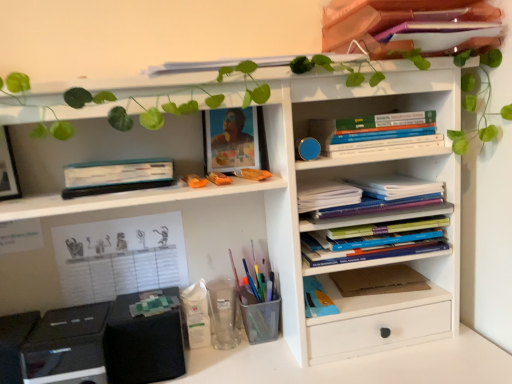
Where is `metal mesh pen holder at lower center, the first stationery from the right`? The width and height of the screenshot is (512, 384). metal mesh pen holder at lower center, the first stationery from the right is located at coordinates click(x=258, y=305).

The height and width of the screenshot is (384, 512). I want to click on transparent plastic cup at lower center, which is the 2th stationery in left-to-right order, so click(223, 313).

Identify the location of hardcover books at center right, the third book in the bottom-to-top sequence. The image size is (512, 384). (380, 133).

Measure the distance between point (381, 56) and camera.

The distance of point (381, 56) from camera is 33.62 inches.

What do you see at coordinates (392, 20) in the screenshot? This screenshot has height=384, width=512. I see `matte pink book at upper right, marked as the 4th book in a bottom-to-top arrangement` at bounding box center [392, 20].

This screenshot has height=384, width=512. Find the location of `matte plastic picture frame at upper center`. matte plastic picture frame at upper center is located at coordinates (230, 139).

Considering the relative sizes of brown cardboard at center-right, the 1th paperback book from the bottom, and hardcover books at center right, the third book in the bottom-to-top sequence, in the image provided, is brown cardboard at center-right, the 1th paperback book from the bottom, smaller than hardcover books at center right, the third book in the bottom-to-top sequence,?

Correct, brown cardboard at center-right, the 1th paperback book from the bottom, occupies less space than hardcover books at center right, the third book in the bottom-to-top sequence.

Considering the positions of point (365, 288) and point (436, 145), is point (365, 288) closer or farther from the camera than point (436, 145)?

Clearly, point (365, 288) is more distant from the camera than point (436, 145).

Does brown cardboard at center-right, the 1th paperback book from the bottom, appear on the left side of hardcover books at center right, the third book in the bottom-to-top sequence?

In fact, brown cardboard at center-right, the 1th paperback book from the bottom, is to the right of hardcover books at center right, the third book in the bottom-to-top sequence.

Is hardcover books at center right, the second book when ordered from top to bottom, completely or partially inside brown cardboard at center-right, which is the 3th paperback book in top-to-bottom order?

No, hardcover books at center right, the second book when ordered from top to bottom, is not a part of brown cardboard at center-right, which is the 3th paperback book in top-to-bottom order.

Is transparent plastic cup at lower center, which is the 2th stationery in left-to-right order, further to the viewer compared to white matte plastic container at lower center, arranged as the first stationery when viewed from the left?

Yes, it is.

From the image's perspective, is transparent plastic cup at lower center, which is the 2th stationery from right to left, located above white matte plastic container at lower center, arranged as the first stationery when viewed from the left?

No, from the image's perspective, transparent plastic cup at lower center, which is the 2th stationery from right to left, is not over white matte plastic container at lower center, arranged as the first stationery when viewed from the left.

Could you tell me if transparent plastic cup at lower center, which is the 2th stationery from right to left, is turned towards white matte plastic container at lower center, the 3th stationery positioned from the right?

No, transparent plastic cup at lower center, which is the 2th stationery from right to left, is not oriented towards white matte plastic container at lower center, the 3th stationery positioned from the right.

From a real-world perspective, who is located lower, transparent plastic cup at lower center, which is the 2th stationery from right to left, or white matte plastic container at lower center, the 3th stationery positioned from the right?

From a 3D spatial view, transparent plastic cup at lower center, which is the 2th stationery from right to left, is below.

Is the depth of transparent plastic cup at lower center, which is the 2th stationery from right to left, greater than that of white paper notebook at center right, the second book ordered from the bottom?

Yes, transparent plastic cup at lower center, which is the 2th stationery from right to left, is further from the camera.

Does transparent plastic cup at lower center, which is the 2th stationery from right to left, have a larger size compared to white paper notebook at center right, marked as the third book in a top-to-bottom arrangement?

Actually, transparent plastic cup at lower center, which is the 2th stationery from right to left, might be smaller than white paper notebook at center right, marked as the third book in a top-to-bottom arrangement.

Can you confirm if transparent plastic cup at lower center, which is the 2th stationery in left-to-right order, is taller than white paper notebook at center right, marked as the third book in a top-to-bottom arrangement?

Yes.

From the image's perspective, who appears lower, transparent plastic cup at lower center, which is the 2th stationery in left-to-right order, or white paper notebook at center right, marked as the third book in a top-to-bottom arrangement?

transparent plastic cup at lower center, which is the 2th stationery in left-to-right order, is shown below in the image.

Which point is more distant from viewer, (196, 282) or (143, 342)?

The point (196, 282) is farther.

Is white matte plastic container at lower center, arranged as the first stationery when viewed from the left, positioned beyond the bounds of black matte speaker at lower left?

Yes, white matte plastic container at lower center, arranged as the first stationery when viewed from the left, is not within black matte speaker at lower left.

Could you tell me if white matte plastic container at lower center, the 3th stationery positioned from the right, is turned towards black matte speaker at lower left?

No.

Is hardcover books at center right, which is the fourth book in top-to-bottom order, surrounding white paper at left, arranged as the 2th paperback book when ordered from the bottom?

No.

Does point (371, 227) come farther from viewer compared to point (63, 293)?

No, it is not.

Considering the relative positions of hardcover books at center right, the 1th book in the bottom-to-top sequence, and white paper at left, which is the 3th paperback book from right to left, in the image provided, is hardcover books at center right, the 1th book in the bottom-to-top sequence, to the left of white paper at left, which is the 3th paperback book from right to left, from the viewer's perspective?

No, hardcover books at center right, the 1th book in the bottom-to-top sequence, is not to the left of white paper at left, which is the 3th paperback book from right to left.

From the image's perspective, which is above, black matte speaker at lower left or metal mesh pen holder at lower center, the first stationery from the right?

metal mesh pen holder at lower center, the first stationery from the right.

Is black matte speaker at lower left aimed at metal mesh pen holder at lower center, which is the third stationery in left-to-right order?

No, black matte speaker at lower left is not facing towards metal mesh pen holder at lower center, which is the third stationery in left-to-right order.

In the image, is black matte speaker at lower left positioned in front of or behind metal mesh pen holder at lower center, the first stationery from the right?

In the image, black matte speaker at lower left appears in front of metal mesh pen holder at lower center, the first stationery from the right.

From a real-world perspective, which object rests below the other?

white paper at left, which is the second paperback book in top-to-bottom order, is physically lower.

Considering the sizes of objects hardcover books at center right, the second book when ordered from top to bottom, and white paper at left, arranged as the 2th paperback book when ordered from the bottom, in the image provided, who is bigger, hardcover books at center right, the second book when ordered from top to bottom, or white paper at left, arranged as the 2th paperback book when ordered from the bottom,?

Bigger between the two is hardcover books at center right, the second book when ordered from top to bottom.

Consider the image. Is hardcover books at center right, the third book in the bottom-to-top sequence, facing away from white paper at left, which is the second paperback book in top-to-bottom order?

hardcover books at center right, the third book in the bottom-to-top sequence, is not turned away from white paper at left, which is the second paperback book in top-to-bottom order.

Does hardcover books at center right, the third book in the bottom-to-top sequence, appear on the right side of white paper at left, which appears as the 1th paperback book when viewed from the left?

Indeed, hardcover books at center right, the third book in the bottom-to-top sequence, is positioned on the right side of white paper at left, which appears as the 1th paperback book when viewed from the left.

The width and height of the screenshot is (512, 384). There is a hardcover books at center right, the second book when ordered from top to bottom. Find the location of `the 3rd paperback book below it (from a real-world perspective)`. the 3rd paperback book below it (from a real-world perspective) is located at coordinates (379, 280).

Where is `stationery located below the white matte plastic container at lower center, the 3th stationery positioned from the right (from the image's perspective)`? stationery located below the white matte plastic container at lower center, the 3th stationery positioned from the right (from the image's perspective) is located at coordinates (223, 313).

Estimate the real-world distances between objects in this image. Which object is further from metal mesh pen holder at lower center, which is the third stationery in left-to-right order, hardcover books at center right, the third book in the bottom-to-top sequence, or transparent plastic cup at lower center, which is the 2th stationery in left-to-right order?

hardcover books at center right, the third book in the bottom-to-top sequence, is positioned further to the anchor metal mesh pen holder at lower center, which is the third stationery in left-to-right order.

Which object lies nearer to the anchor point black matte speaker at lower left, brown cardboard at center-right, placed as the 1th paperback book when sorted from right to left, or hardcover books at center right, the third book in the bottom-to-top sequence?

The object closer to black matte speaker at lower left is brown cardboard at center-right, placed as the 1th paperback book when sorted from right to left.

Looking at the image, which one is located further to brown cardboard at center-right, the 1th paperback book from the bottom, matte plastic picture frame at upper center or matte pink book at upper right, which appears as the first book when viewed from the top?

Based on the image, matte pink book at upper right, which appears as the first book when viewed from the top, appears to be further to brown cardboard at center-right, the 1th paperback book from the bottom.

When comparing their distances from hardcover books at center right, which is the fourth book in top-to-bottom order, does matte plastic picture frame at upper center or white paper notebook at center right, the second book ordered from the bottom, seem further?

matte plastic picture frame at upper center is positioned further to the anchor hardcover books at center right, which is the fourth book in top-to-bottom order.

When comparing their distances from white matte plastic container at lower center, the 3th stationery positioned from the right, does transparent plastic cup at lower center, which is the 2th stationery in left-to-right order, or black matte speaker at lower left seem closer?

The object closer to white matte plastic container at lower center, the 3th stationery positioned from the right, is transparent plastic cup at lower center, which is the 2th stationery in left-to-right order.

Estimate the real-world distances between objects in this image. Which object is closer to metal mesh pen holder at lower center, the first stationery from the right, black matte speaker at lower left or teal matte hardcover book at left, the 3th paperback book when ordered from bottom to top?

Among the two, black matte speaker at lower left is located nearer to metal mesh pen holder at lower center, the first stationery from the right.

When comparing their distances from hardcover books at center right, the 1th book in the bottom-to-top sequence, does matte pink book at upper right, which appears as the first book when viewed from the top, or brown cardboard at center-right, which is counted as the third paperback book, starting from the left, seem closer?

brown cardboard at center-right, which is counted as the third paperback book, starting from the left, is positioned closer to the anchor hardcover books at center right, the 1th book in the bottom-to-top sequence.

Looking at the image, which one is located closer to matte plastic picture frame at upper center, white paper notebook at center right, marked as the third book in a top-to-bottom arrangement, or matte pink book at upper right, which appears as the first book when viewed from the top?

Based on the image, white paper notebook at center right, marked as the third book in a top-to-bottom arrangement, appears to be nearer to matte plastic picture frame at upper center.

You are a GUI agent. You are given a task and a screenshot of the screen. Output one action in this format:
    pyautogui.click(x=<x>, y=<y>)
    Task: Click on the speaker located between white paper at left, which is the second paperback book in top-to-bottom order, and white matte plastic container at lower center, the 3th stationery positioned from the right, in the left-right direction
    This screenshot has height=384, width=512.
    Given the screenshot: What is the action you would take?
    pyautogui.click(x=145, y=338)

This screenshot has width=512, height=384. What are the coordinates of `picture frame between matte pink book at upper right, marked as the 4th book in a bottom-to-top arrangement, and brown cardboard at center-right, which is the 3th paperback book in top-to-bottom order, vertically` in the screenshot? It's located at (x=230, y=139).

Find the location of a particular element. speaker located between teal matte hardcover book at left, which is counted as the first paperback book, starting from the top, and hardcover books at center right, the 1th book in the bottom-to-top sequence, in the left-right direction is located at coordinates (145, 338).

You are a GUI agent. You are given a task and a screenshot of the screen. Output one action in this format:
    pyautogui.click(x=<x>, y=<y>)
    Task: Click on the speaker between white paper at left, which is the second paperback book in top-to-bottom order, and hardcover books at center right, the 1th book in the bottom-to-top sequence, in the horizontal direction
    This screenshot has height=384, width=512.
    Given the screenshot: What is the action you would take?
    pyautogui.click(x=145, y=338)